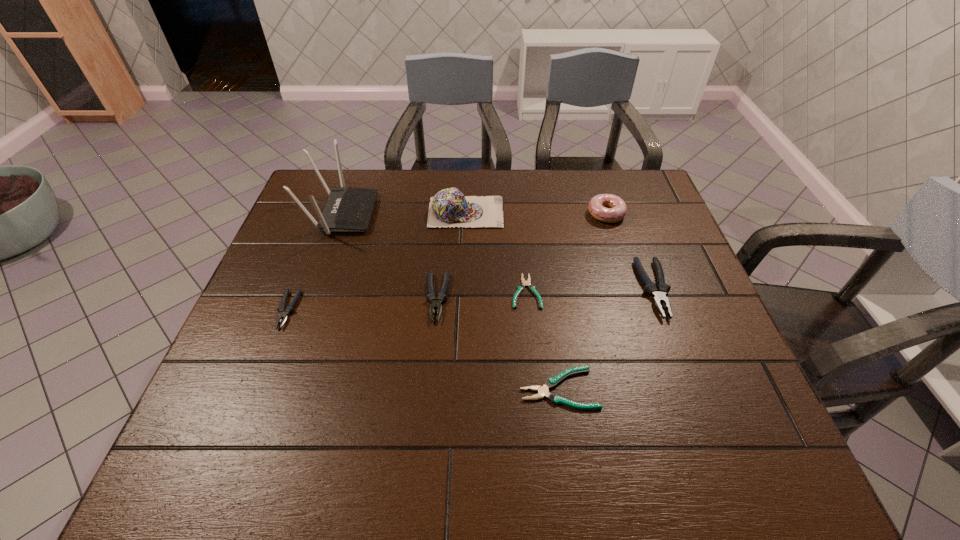
The height and width of the screenshot is (540, 960). What are the coordinates of `vacant area located on the right of the nearest pliers` in the screenshot? It's located at (730, 388).

Locate an element on the screen. This screenshot has width=960, height=540. vacant position located 0.090m on the right of the shortest object is located at coordinates (576, 292).

The width and height of the screenshot is (960, 540). I want to click on router present at the far edge, so click(347, 209).

Locate an element on the screen. cap located at the far edge is located at coordinates (449, 207).

Where is `doughnut at the far edge`? The image size is (960, 540). doughnut at the far edge is located at coordinates (617, 209).

In order to click on router located in the left edge section of the desktop in this screenshot , I will do `click(347, 209)`.

Find the location of a particular element. The height and width of the screenshot is (540, 960). pliers present at the left edge is located at coordinates (284, 313).

Identify the location of doughnut present at the right edge. The height and width of the screenshot is (540, 960). (617, 209).

The image size is (960, 540). Find the location of `pliers that is positioned at the right edge`. pliers that is positioned at the right edge is located at coordinates (659, 293).

Find the location of a particular element. object present at the far left corner is located at coordinates (347, 209).